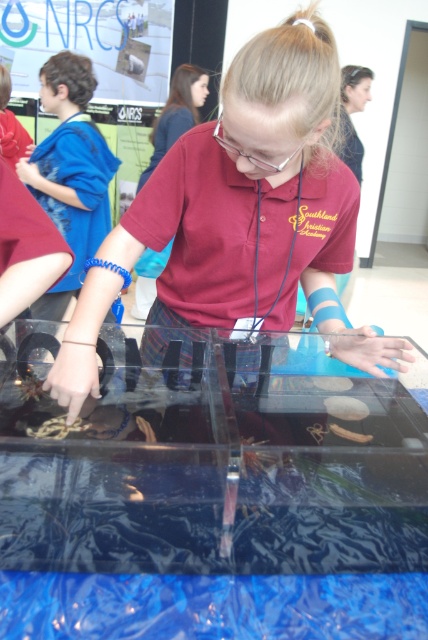
Is maroon fabric shirt at center bigger than clear plastic goggles at center?

Correct, maroon fabric shirt at center is larger in size than clear plastic goggles at center.

Based on the photo, can you confirm if maroon fabric shirt at center is wider than clear plastic goggles at center?

Indeed, maroon fabric shirt at center has a greater width compared to clear plastic goggles at center.

Find the location of `maroon fabric shirt at center`. maroon fabric shirt at center is located at coordinates (177, 113).

Find the location of a particular element. The height and width of the screenshot is (640, 428). maroon fabric shirt at center is located at coordinates (177, 113).

Who is positioned more to the left, transparent acrylic table at center or blue fabric wristband at upper left?

blue fabric wristband at upper left

Is point (356, 401) less distant than point (92, 72)?

Yes, it is.

Find the location of `transparent acrylic table at center`. transparent acrylic table at center is located at coordinates (208, 493).

In the scene shown: Does transparent acrylic table at center appear on the left side of matte plastic container at center?

Indeed, transparent acrylic table at center is positioned on the left side of matte plastic container at center.

Is point (395, 480) closer to camera compared to point (318, 198)?

Yes, it is.

Locate an element on the screen. transparent acrylic table at center is located at coordinates pos(208,493).